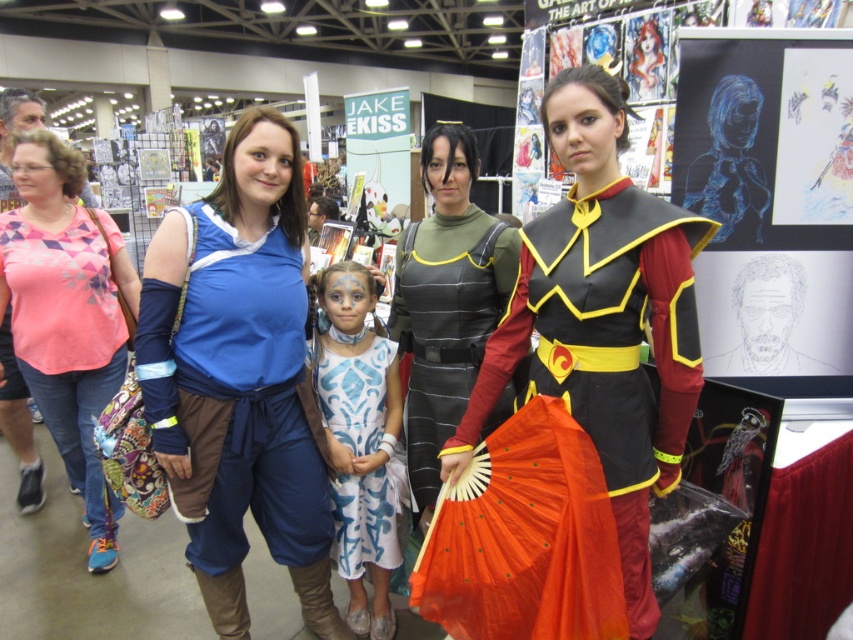
You are at the convention and want to take a photo of the shiny black armor at center. Where should you stand to get the best view?

The shiny black armor at center is located at point (602, 321) so you should stand directly in front of that coordinate to get the best view.

You are an artist who wants to draw a figure that is proportionate to the shiny black armor at center. Looking at the blue chalk drawing of a woman at center, can you tell if the drawing is smaller or larger than the armor?

The blue chalk drawing of a woman at center is smaller than the shiny black armor at center because the armor is much taller.

You are a photographer at the event and need to capture a photo where both the shiny black armor at center and the white painted fabric dress at center are visible. Considering their sizes, which object should you position closer to the camera to ensure both are in frame without cropping?

The shiny black armor at center is much taller than the white painted fabric dress at center, so positioning the white painted fabric dress at center closer to the camera will allow both to fit within the frame without cropping, as the armor can be seen in the background while the dress is nearer.